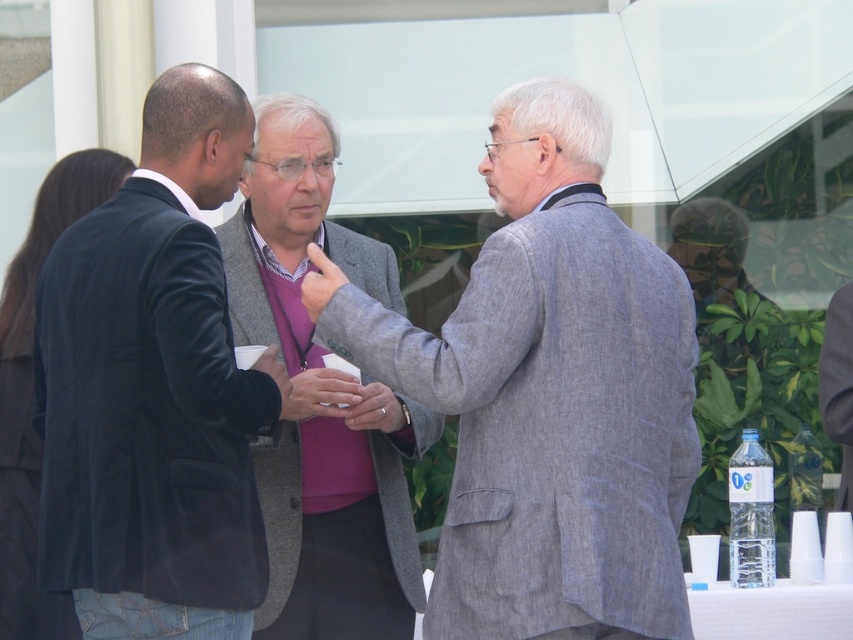
You are standing at the entrance of the building and want to approach the gray textured suit at center. Which direction should you walk to reach it?

The gray textured suit at center is located at point [550,396], so you should walk towards the center of the image to reach it.

You are a photographer at the event and want to capture a closeup of the gray woolen blazer at center and the smooth gray hand at center in the same frame. Which object should you focus on first if you want to ensure both are in focus?

The gray woolen blazer at center is larger than the smooth gray hand at center, so focusing on the gray woolen blazer at center first would help ensure both are in focus.